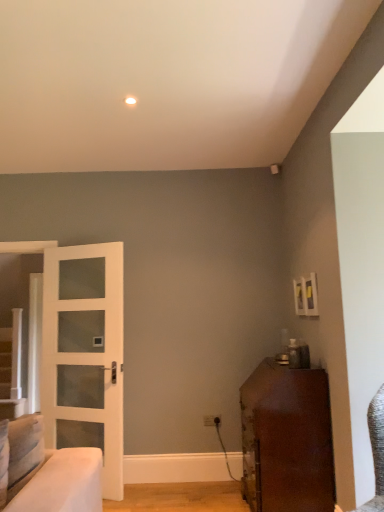
Question: From the image's perspective, is white glass door at left under shiny brown cabinet at lower right?

Choices:
 (A) no
 (B) yes

Answer: (A)

Question: Considering the relative sizes of white glass door at left and shiny brown cabinet at lower right in the image provided, is white glass door at left smaller than shiny brown cabinet at lower right?

Choices:
 (A) yes
 (B) no

Answer: (A)

Question: Considering the relative positions of white glass door at left and shiny brown cabinet at lower right in the image provided, is white glass door at left to the right of shiny brown cabinet at lower right from the viewer's perspective?

Choices:
 (A) no
 (B) yes

Answer: (A)

Question: Does white glass door at left have a greater height compared to shiny brown cabinet at lower right?

Choices:
 (A) yes
 (B) no

Answer: (A)

Question: Can you confirm if white glass door at left is thinner than shiny brown cabinet at lower right?

Choices:
 (A) no
 (B) yes

Answer: (B)

Question: Considering the relative sizes of white glass door at left and shiny brown cabinet at lower right in the image provided, is white glass door at left shorter than shiny brown cabinet at lower right?

Choices:
 (A) yes
 (B) no

Answer: (B)

Question: Is shiny brown cabinet at lower right further to the viewer compared to white glass door at left?

Choices:
 (A) no
 (B) yes

Answer: (A)

Question: Does shiny brown cabinet at lower right have a larger size compared to white glass door at left?

Choices:
 (A) yes
 (B) no

Answer: (A)

Question: Can we say shiny brown cabinet at lower right lies outside white glass door at left?

Choices:
 (A) no
 (B) yes

Answer: (B)

Question: Is shiny brown cabinet at lower right aimed at white glass door at left?

Choices:
 (A) yes
 (B) no

Answer: (A)

Question: From a real-world perspective, is shiny brown cabinet at lower right physically below white glass door at left?

Choices:
 (A) yes
 (B) no

Answer: (A)

Question: From the image's perspective, is shiny brown cabinet at lower right located above white glass door at left?

Choices:
 (A) no
 (B) yes

Answer: (A)

Question: Considering the positions of shiny brown cabinet at lower right and white glass door at left in the image, is shiny brown cabinet at lower right taller or shorter than white glass door at left?

Choices:
 (A) tall
 (B) short

Answer: (B)